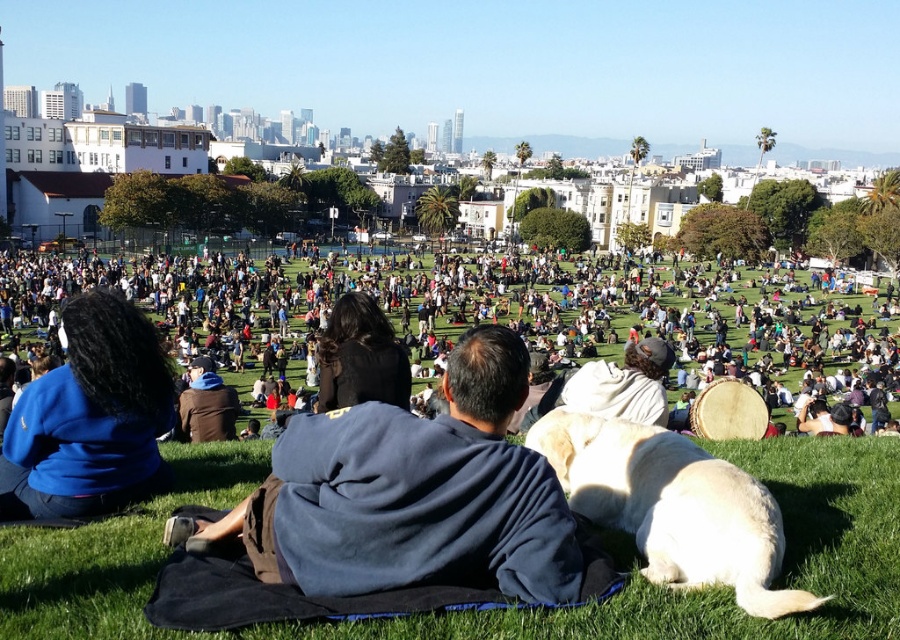
From the picture: You are a photographer trying to capture a clear shot of the white fluffy dog at center and the light yellow fur at lower center. Since you want to focus on the taller subject, which one should you aim your camera at?

The white fluffy dog at center is taller than the light yellow fur at lower center, so you should aim your camera at the white fluffy dog at center to focus on the taller subject.

You are a photographer trying to capture a clear shot of the green grass at center and the dark blue fleece at center. Which object appears taller in the photo?

→ The dark blue fleece at center appears taller than the green grass at center in the photo.